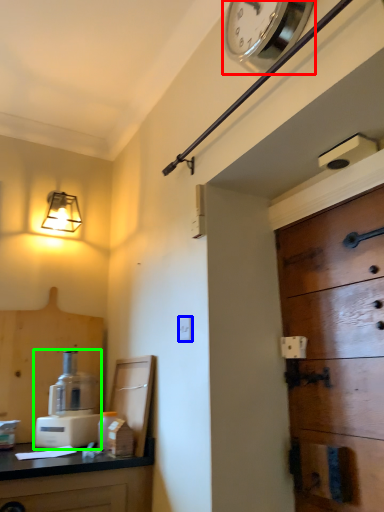
Question: Considering the real-world distances, which object is farthest from clock (highlighted by a red box)? light switch (highlighted by a blue box) or coffee machine (highlighted by a green box)?

Choices:
 (A) light switch
 (B) coffee machine

Answer: (B)